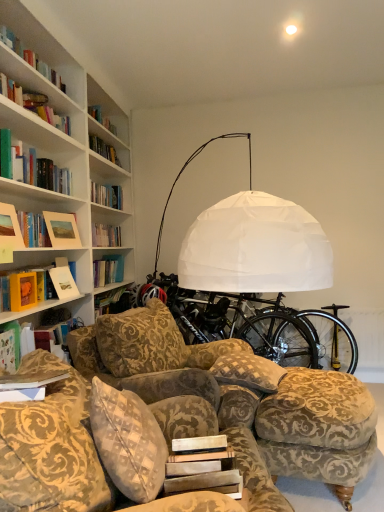
Question: Considering the relative positions of matte green book at left, the 1th book when ordered from front to back, and black matte bicycle at center in the image provided, is matte green book at left, the 1th book when ordered from front to back, to the right of black matte bicycle at center from the viewer's perspective?

Choices:
 (A) yes
 (B) no

Answer: (B)

Question: From a real-world perspective, is matte green book at left, the 1th book when ordered from front to back, located higher than black matte bicycle at center?

Choices:
 (A) no
 (B) yes

Answer: (B)

Question: Could you tell me if matte green book at left, the 1th book when ordered from front to back, is facing black matte bicycle at center?

Choices:
 (A) no
 (B) yes

Answer: (A)

Question: Considering the relative sizes of matte green book at left, which is the first book in bottom-to-top order, and black matte bicycle at center in the image provided, is matte green book at left, which is the first book in bottom-to-top order, bigger than black matte bicycle at center?

Choices:
 (A) yes
 (B) no

Answer: (B)

Question: Is matte green book at left, which is the first book in bottom-to-top order, oriented away from black matte bicycle at center?

Choices:
 (A) no
 (B) yes

Answer: (A)

Question: Can you confirm if matte green book at left, the second book in the back-to-front sequence, is smaller than black matte bicycle at center?

Choices:
 (A) yes
 (B) no

Answer: (A)

Question: From a real-world perspective, is matte wooden picture frame at upper left, marked as the 1th picture frame in a front-to-back arrangement, positioned under gold-patterned fabric ottoman at lower right based on gravity?

Choices:
 (A) yes
 (B) no

Answer: (B)

Question: Is matte wooden picture frame at upper left, marked as the 1th picture frame in a front-to-back arrangement, positioned in front of gold-patterned fabric ottoman at lower right?

Choices:
 (A) no
 (B) yes

Answer: (B)

Question: Does matte wooden picture frame at upper left, marked as the 1th picture frame in a front-to-back arrangement, turn towards gold-patterned fabric ottoman at lower right?

Choices:
 (A) yes
 (B) no

Answer: (B)

Question: Is matte wooden picture frame at upper left, marked as the 1th picture frame in a front-to-back arrangement, to the left of gold-patterned fabric ottoman at lower right from the viewer's perspective?

Choices:
 (A) no
 (B) yes

Answer: (B)

Question: Does matte wooden picture frame at upper left, marked as the 2th picture frame in a back-to-front arrangement, have a larger size compared to gold-patterned fabric ottoman at lower right?

Choices:
 (A) no
 (B) yes

Answer: (A)

Question: Can you confirm if matte wooden picture frame at upper left, marked as the 1th picture frame in a front-to-back arrangement, is shorter than gold-patterned fabric ottoman at lower right?

Choices:
 (A) yes
 (B) no

Answer: (A)

Question: Does black metallic bicycle wheel at lower right have a greater width compared to black matte bicycle at center?

Choices:
 (A) no
 (B) yes

Answer: (A)